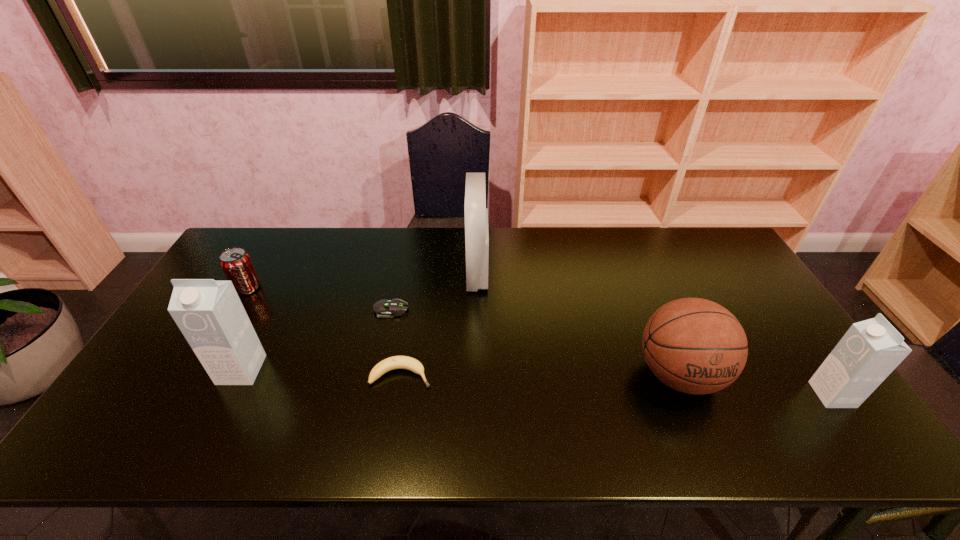
This screenshot has height=540, width=960. Find the location of `the sixth object from left to right`. the sixth object from left to right is located at coordinates (696, 346).

What are the coordinates of `free spot located on the front label of the left carton` in the screenshot? It's located at (220, 414).

Where is `free point located on the front label of the rightmost object`? free point located on the front label of the rightmost object is located at coordinates (655, 395).

Identify the location of free space located 0.060m on the front label of the rightmost object. The image size is (960, 540). (792, 395).

Locate an element on the screen. This screenshot has height=540, width=960. free space located 0.140m on the front label of the rightmost object is located at coordinates (759, 395).

Where is `vacant area situated 0.070m on the right of the leftmost object`? The width and height of the screenshot is (960, 540). vacant area situated 0.070m on the right of the leftmost object is located at coordinates (282, 288).

You are a GUI agent. You are given a task and a screenshot of the screen. Output one action in this format:
    pyautogui.click(x=<x>, y=<y>)
    Task: Click on the free region located 0.400m on the right of the fifth nearest object
    The width and height of the screenshot is (960, 540).
    Given the screenshot: What is the action you would take?
    pyautogui.click(x=543, y=310)

Find the location of `vacant space situated on the front-facing side of the first-aid kit`. vacant space situated on the front-facing side of the first-aid kit is located at coordinates (586, 274).

The image size is (960, 540). Find the location of `vacant position located at the stem of the banana`. vacant position located at the stem of the banana is located at coordinates (486, 375).

Find the location of a particular element. The height and width of the screenshot is (540, 960). object situated at the far edge is located at coordinates (476, 214).